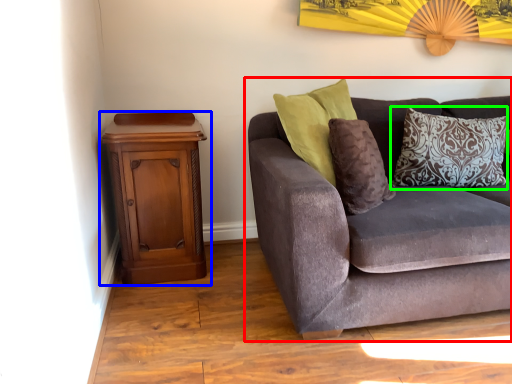
Question: Which is nearer to the studio couch (highlighted by a red box)? nightstand (highlighted by a blue box) or pillow (highlighted by a green box).

Choices:
 (A) nightstand
 (B) pillow

Answer: (B)